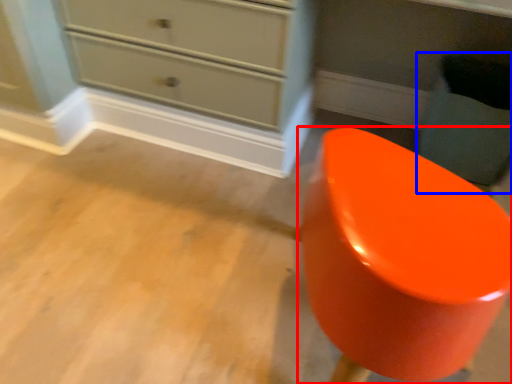
Question: Which object appears farthest to the camera in this image, furniture (highlighted by a red box) or swivel chair (highlighted by a blue box)?

Choices:
 (A) furniture
 (B) swivel chair

Answer: (B)